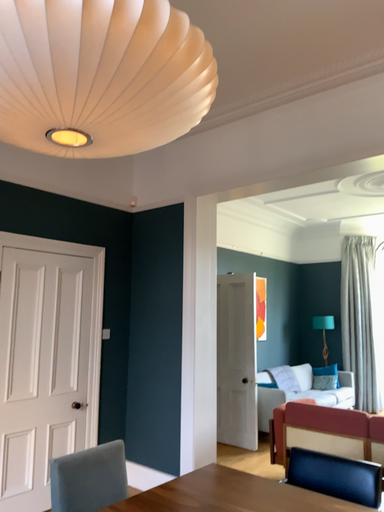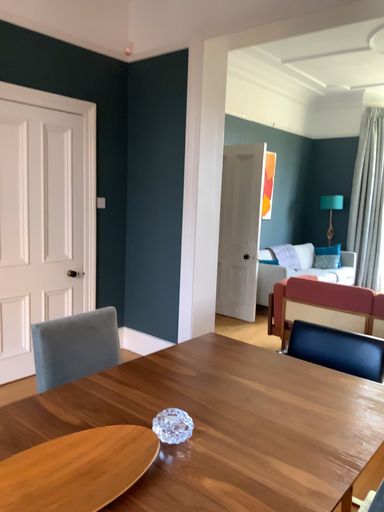
Question: How did the camera likely rotate when shooting the video?

Choices:
 (A) rotated upward
 (B) rotated downward

Answer: (B)